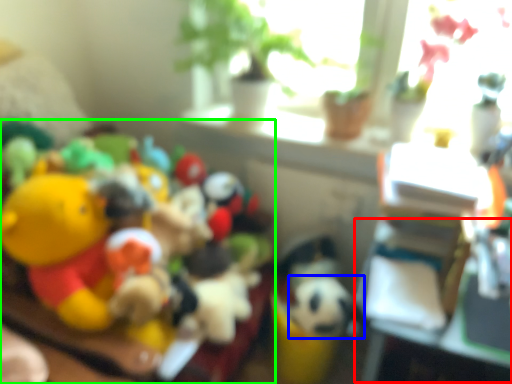
Question: Which object is positioned farthest from table (highlighted by a red box)? Select from animal (highlighted by a blue box) and toy (highlighted by a green box).

Choices:
 (A) animal
 (B) toy

Answer: (B)